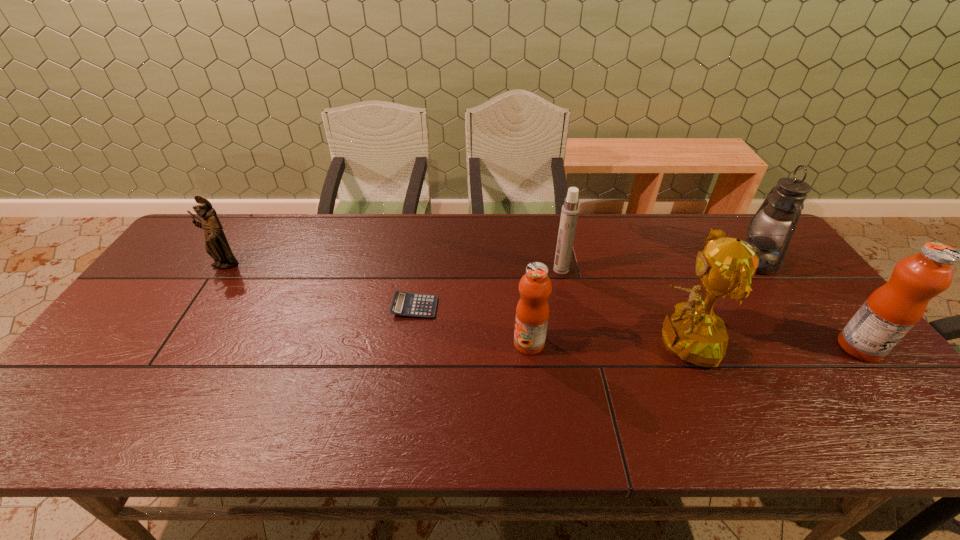
At what (x,y) coordinates should I click in order to perform the action: click on blank space at the near left corner of the desktop. Please return your answer as a coordinate pair (x, y). Looking at the image, I should click on coord(89,378).

Locate an element on the screen. vacant space at the far right corner of the desktop is located at coordinates (708, 221).

Image resolution: width=960 pixels, height=540 pixels. What are the coordinates of `vacant area that lies between the third object from left to right and the sixth object from right to left` in the screenshot? It's located at (472, 325).

You are a GUI agent. You are given a task and a screenshot of the screen. Output one action in this format:
    pyautogui.click(x=<x>, y=<y>)
    Task: Click on the free space that is in between the right fruit juice and the oil lamp
    
    Given the screenshot: What is the action you would take?
    pyautogui.click(x=807, y=304)

Identify the location of free spot between the fourth object from left to right and the leftmost object. (393, 267).

The image size is (960, 540). I want to click on free spot between the leftmost object and the oil lamp, so click(x=490, y=263).

You are a GUI agent. You are given a task and a screenshot of the screen. Output one action in this format:
    pyautogui.click(x=<x>, y=<y>)
    Task: Click on the free area in between the fourth object from right to left and the fifth object from left to right
    This screenshot has height=540, width=960.
    Given the screenshot: What is the action you would take?
    pyautogui.click(x=620, y=306)

Image resolution: width=960 pixels, height=540 pixels. Identify the location of object that is the fourth closest to the left fruit juice. (774, 223).

Identify which object is the third closest to the right fruit juice. Please provide its 2D coordinates. Your answer should be formatted as a tuple, i.e. [(x, y)], where the tuple contains the x and y coordinates of a point satisfying the conditions above.

[(569, 215)]

Where is `free spot that satisfies the following two spatial constraints: 1. on the front-facing side of the leftmost object; 2. on the left side of the fourth object from right to left`? The height and width of the screenshot is (540, 960). free spot that satisfies the following two spatial constraints: 1. on the front-facing side of the leftmost object; 2. on the left side of the fourth object from right to left is located at coordinates (222, 269).